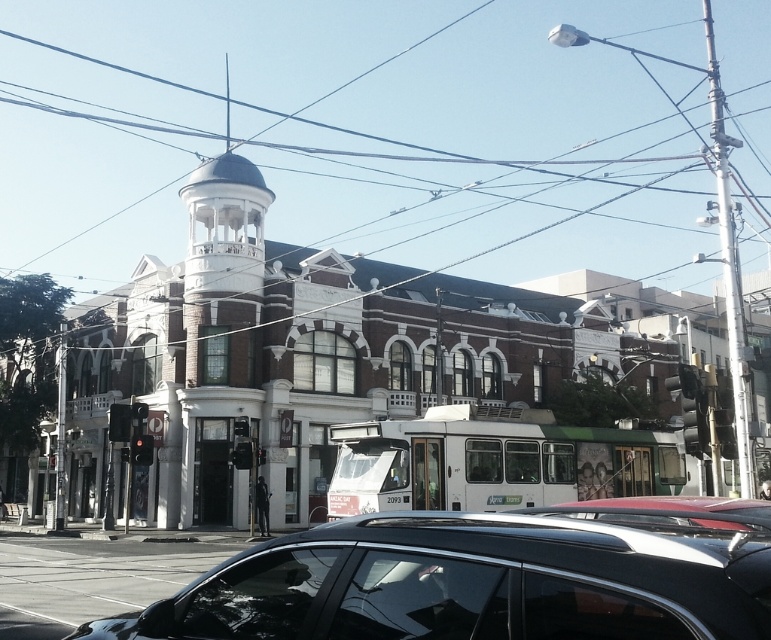
Question: Estimate the real-world distances between objects in this image. Which object is farther from the white matte bus at center?

Choices:
 (A) black glossy car at lower center
 (B) metallic silver car at lower center

Answer: (A)

Question: Which object is closer to the camera taking this photo?

Choices:
 (A) white matte bus at center
 (B) metallic silver car at lower center
 (C) black glossy car at lower center

Answer: (C)

Question: Is black glossy car at lower center wider than white matte bus at center?

Choices:
 (A) no
 (B) yes

Answer: (A)

Question: Does black glossy car at lower center have a smaller size compared to white matte bus at center?

Choices:
 (A) yes
 (B) no

Answer: (A)

Question: Is white matte bus at center smaller than metallic silver car at lower center?

Choices:
 (A) yes
 (B) no

Answer: (A)

Question: Which of the following is the farthest from the observer?

Choices:
 (A) (635, 499)
 (B) (280, 556)
 (C) (598, 461)

Answer: (C)